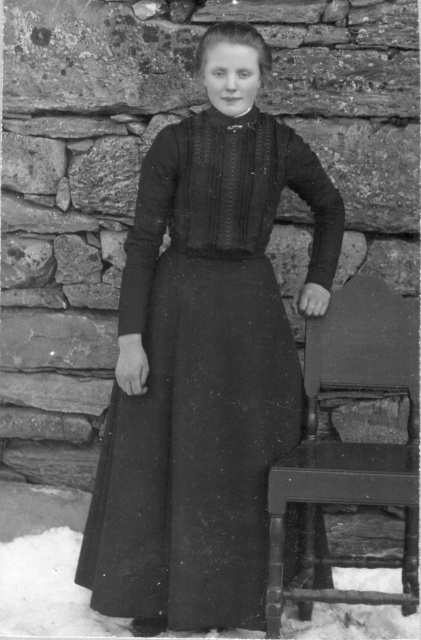
You are standing in the scene and want to sit down on the dark wood chair at right. However, there is white powdery snow at lower left in your path. Which direction should you move to avoid stepping on the snow?

To avoid stepping on the white powdery snow at lower left, you should move to the right towards the dark wood chair at right, as the snow is located to the left of the chair.

You are an observer in the scene. You see the black matte dress at center and the white powdery snow at lower left. Which object is positioned to the right of the other?

The black matte dress at center is to the right of white powdery snow at lower left.

You are a photographer setting up a shoot in this outdoor scene. You want to place a small tripod between the dark wood chair at right and the white powdery snow at lower left. Based on their positions, where should you place the tripod to ensure it is between both objects?

The dark wood chair at right is above the white powdery snow at lower left, so you should place the tripod somewhere between the lower left and the chair at right, ensuring it is positioned below the chair and above the snow to be between both objects.